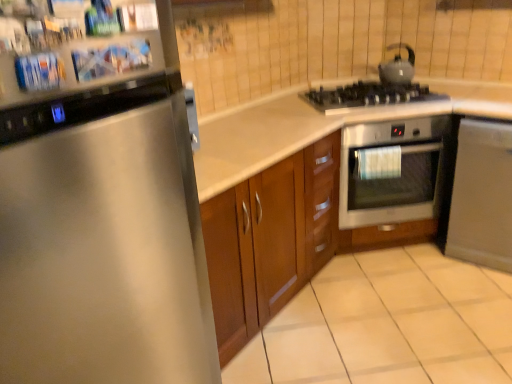
Question: From the image's perspective, is black matte gas stove at upper right on satin silver dishwasher at lower right?

Choices:
 (A) yes
 (B) no

Answer: (A)

Question: From a real-world perspective, is black matte gas stove at upper right physically below satin silver dishwasher at lower right?

Choices:
 (A) no
 (B) yes

Answer: (A)

Question: Is black matte gas stove at upper right at the left side of satin silver dishwasher at lower right?

Choices:
 (A) yes
 (B) no

Answer: (A)

Question: Is black matte gas stove at upper right not inside satin silver dishwasher at lower right?

Choices:
 (A) yes
 (B) no

Answer: (A)

Question: Is black matte gas stove at upper right taller than satin silver dishwasher at lower right?

Choices:
 (A) yes
 (B) no

Answer: (B)

Question: Is point (453, 109) closer or farther from the camera than point (415, 82)?

Choices:
 (A) farther
 (B) closer

Answer: (B)

Question: Is white glossy countertop at center inside or outside of black matte gas stove at upper right?

Choices:
 (A) inside
 (B) outside

Answer: (B)

Question: Looking at the image, does white glossy countertop at center seem bigger or smaller compared to black matte gas stove at upper right?

Choices:
 (A) small
 (B) big

Answer: (B)

Question: Based on their positions, is white glossy countertop at center located to the left or right of black matte gas stove at upper right?

Choices:
 (A) right
 (B) left

Answer: (B)

Question: Is stainless steel oven at center-right taller or shorter than satin silver dishwasher at lower right?

Choices:
 (A) short
 (B) tall

Answer: (A)

Question: Considering the relative positions of stainless steel oven at center-right and satin silver dishwasher at lower right in the image provided, is stainless steel oven at center-right to the left or to the right of satin silver dishwasher at lower right?

Choices:
 (A) right
 (B) left

Answer: (B)

Question: Is point [x=424, y=120] positioned closer to the camera than point [x=479, y=221]?

Choices:
 (A) farther
 (B) closer

Answer: (B)

Question: In terms of width, does stainless steel oven at center-right look wider or thinner when compared to satin silver dishwasher at lower right?

Choices:
 (A) wide
 (B) thin

Answer: (B)

Question: Looking at their shapes, would you say matte black kettle at upper right is wider or thinner than stainless steel refrigerator at left?

Choices:
 (A) wide
 (B) thin

Answer: (B)

Question: Considering their positions, is matte black kettle at upper right located in front of or behind stainless steel refrigerator at left?

Choices:
 (A) front
 (B) behind

Answer: (B)